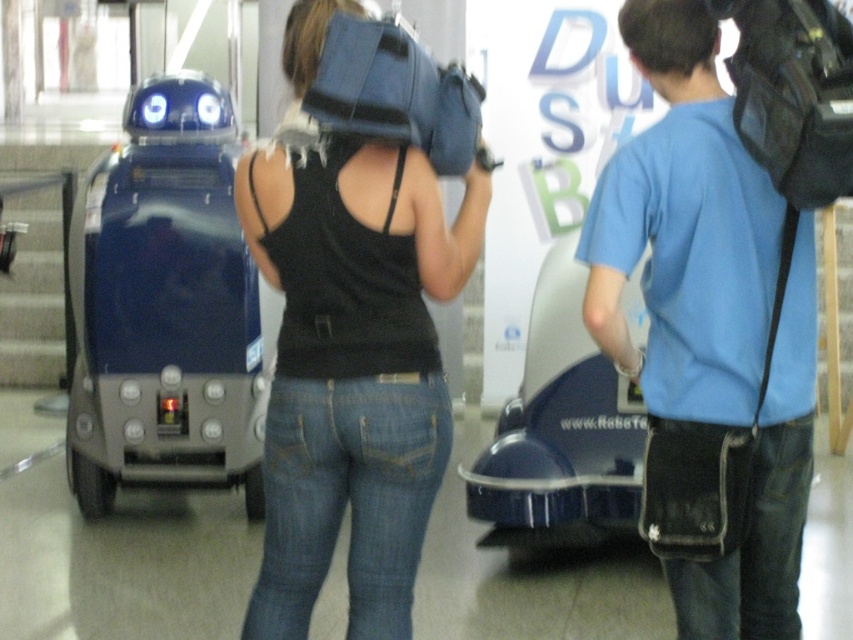
Question: Can you confirm if blue matte shirt at center is positioned to the right of shiny blue robot at left?

Choices:
 (A) yes
 (B) no

Answer: (A)

Question: Which point appears farthest from the camera in this image?

Choices:
 (A) (244, 289)
 (B) (674, 147)

Answer: (A)

Question: Does blue matte shirt at center lie behind shiny blue robot at left?

Choices:
 (A) no
 (B) yes

Answer: (A)

Question: Estimate the real-world distances between objects in this image. Which object is farther from the black matte tank top at center?

Choices:
 (A) blue matte shirt at center
 (B) shiny blue robot at left

Answer: (B)

Question: Is black matte tank top at center closer to the viewer compared to shiny blue robot at left?

Choices:
 (A) no
 (B) yes

Answer: (B)

Question: Which object is closer to the camera taking this photo?

Choices:
 (A) shiny blue robot at left
 (B) blue matte shirt at center

Answer: (B)